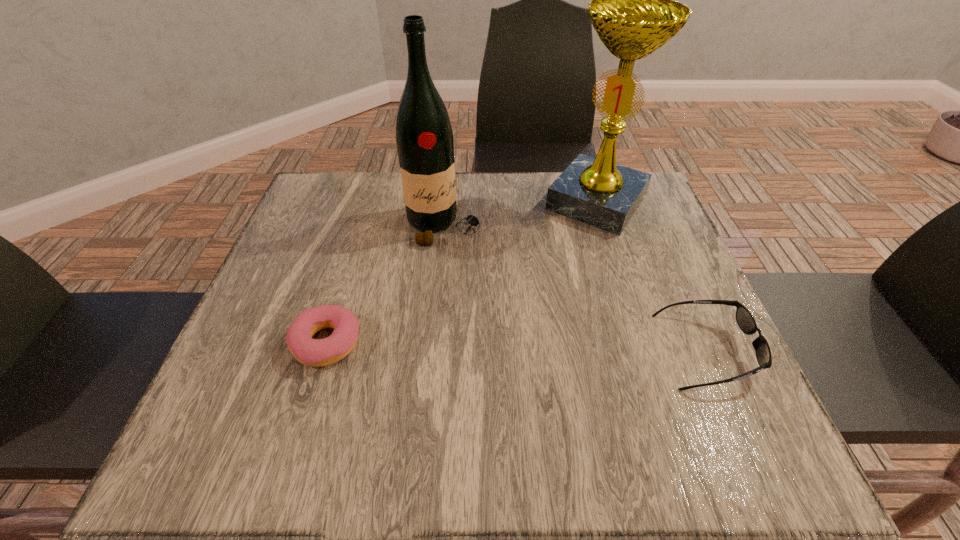
What are the coordinates of `free space located 0.110m on the surface of the third object from right to left` in the screenshot? It's located at (481, 276).

Where is `blank area located 0.320m on the surface of the third object from right to left`? The image size is (960, 540). blank area located 0.320m on the surface of the third object from right to left is located at coordinates (535, 348).

Image resolution: width=960 pixels, height=540 pixels. I want to click on award present at the far edge, so click(634, 11).

This screenshot has width=960, height=540. Find the location of `wine bottle that is at the far edge`. wine bottle that is at the far edge is located at coordinates (424, 137).

What are the coordinates of `doughnut situated at the near edge` in the screenshot? It's located at (321, 352).

You are a GUI agent. You are given a task and a screenshot of the screen. Output one action in this format:
    pyautogui.click(x=<x>, y=<y>)
    Task: Click on the sunglasses that is at the near edge
    
    Given the screenshot: What is the action you would take?
    pyautogui.click(x=746, y=322)

You are a GUI agent. You are given a task and a screenshot of the screen. Output one action in this format:
    pyautogui.click(x=<x>, y=<y>)
    Task: Click on the object that is at the left edge
    This screenshot has width=960, height=540.
    Given the screenshot: What is the action you would take?
    pyautogui.click(x=321, y=352)

Identify the location of sunglasses at the right edge. (746, 322).

Locate an element on the screen. This screenshot has width=960, height=540. award located in the right edge section of the desktop is located at coordinates (634, 11).

The height and width of the screenshot is (540, 960). Find the location of `object present at the near left corner`. object present at the near left corner is located at coordinates (321, 352).